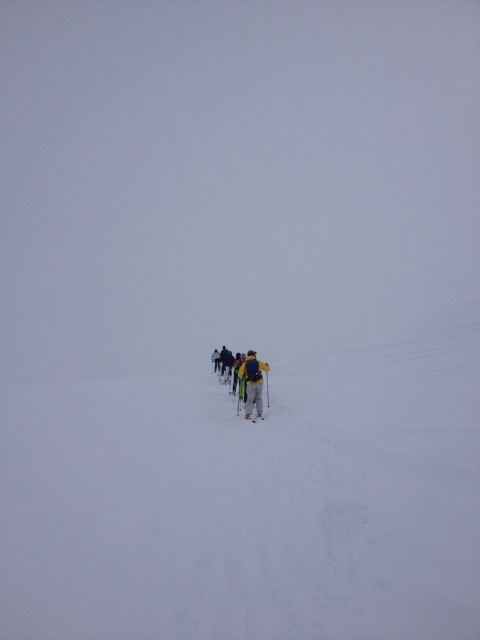
Question: Where is yellow fabric backpack at center located in relation to yellow matte ski at center in the image?

Choices:
 (A) above
 (B) below

Answer: (A)

Question: From the image, what is the correct spatial relationship of yellow fabric backpack at center in relation to yellow matte ski at center?

Choices:
 (A) right
 (B) left

Answer: (B)

Question: Does yellow fabric backpack at center have a larger size compared to yellow matte ski at center?

Choices:
 (A) yes
 (B) no

Answer: (A)

Question: Among these points, which one is farthest from the camera?

Choices:
 (A) (252, 362)
 (B) (252, 419)

Answer: (A)